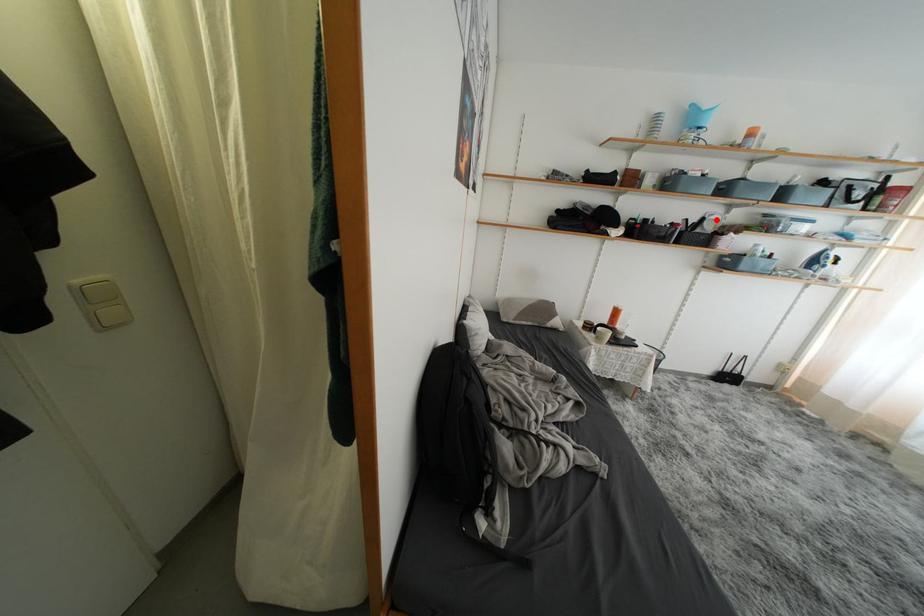
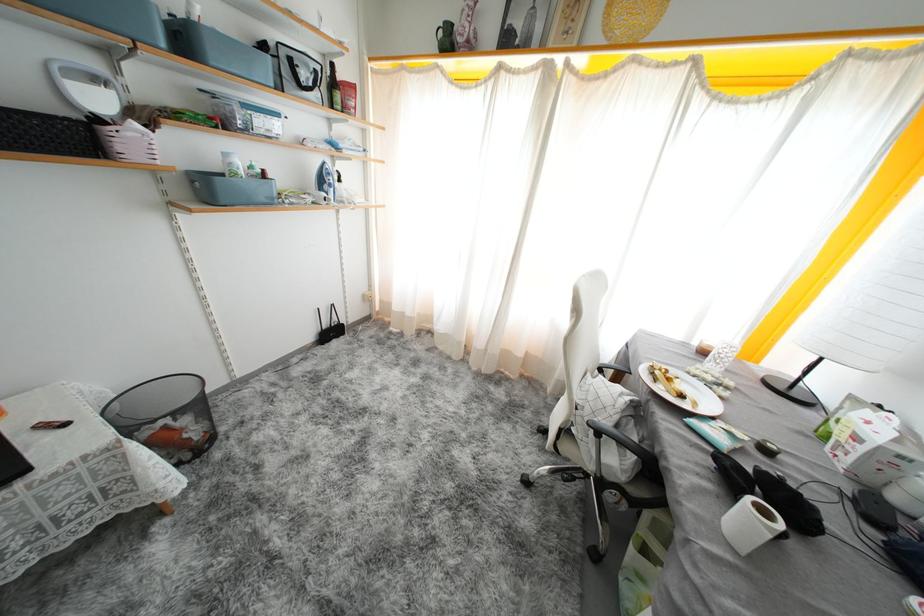
Question: I am providing you with two images of the same scene from different viewpoints. A red point is marked on the first image. Can you still see the location of the red point in image 2?

Choices:
 (A) Yes
 (B) No

Answer: (A)